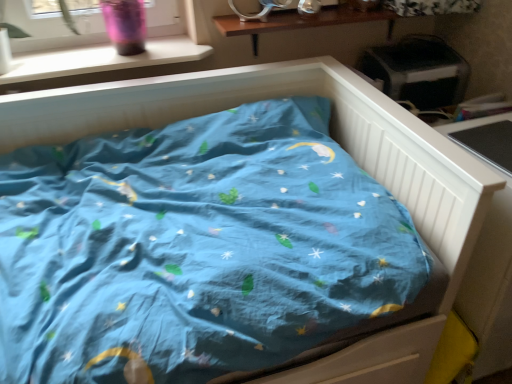
Image resolution: width=512 pixels, height=384 pixels. I want to click on white wooden table at right, so click(x=490, y=284).

Describe the element at coordinates (490, 284) in the screenshot. The width and height of the screenshot is (512, 384). I see `white wooden table at right` at that location.

Measure the distance between point (479, 371) and camera.

They are 1.31 meters apart.

What do you see at coordinates (96, 61) in the screenshot?
I see `white plastic window sill at upper left` at bounding box center [96, 61].

Identify the location of white plastic window sill at upper left. (96, 61).

I want to click on white wooden table at right, so click(x=490, y=284).

Between white wooden table at right and white plastic window sill at upper left, which one appears on the left side from the viewer's perspective?

white plastic window sill at upper left is more to the left.

Is white wooden table at right positioned in front of white plastic window sill at upper left?

That is True.

Which is behind, point (499, 358) or point (145, 53)?

The point (145, 53) is behind.

Consider the image. From the image's perspective, is white wooden table at right above white plastic window sill at upper left?

No.

From a real-world perspective, is white wooden table at right physically below white plastic window sill at upper left?

Yes, from a real-world perspective, white wooden table at right is below white plastic window sill at upper left.

Considering the sizes of objects white wooden table at right and white plastic window sill at upper left in the image provided, who is thinner, white wooden table at right or white plastic window sill at upper left?

white plastic window sill at upper left is thinner.

Does white wooden table at right have a greater height compared to white plastic window sill at upper left?

Correct, white wooden table at right is much taller as white plastic window sill at upper left.

Does white wooden table at right have a larger size compared to white plastic window sill at upper left?

Yes, white wooden table at right is bigger than white plastic window sill at upper left.

Is white plastic window sill at upper left a part of white wooden table at right?

No, white plastic window sill at upper left is not surrounded by white wooden table at right.

Are white wooden table at right and white plastic window sill at upper left located far from each other?

white wooden table at right is far away from white plastic window sill at upper left.

Is white wooden table at right facing away from white plastic window sill at upper left?

No, white plastic window sill at upper left is not at the back of white wooden table at right.

What's the angular difference between white wooden table at right and white plastic window sill at upper left's facing directions?

There is a 1.19-degree angle between the facing directions of white wooden table at right and white plastic window sill at upper left.

I want to click on window sill behind the white wooden table at right, so click(x=96, y=61).

Does white plastic window sill at upper left appear on the right side of white wooden table at right?

No.

Between white plastic window sill at upper left and white wooden table at right, which one is positioned in front?

white wooden table at right is closer to the camera.

Considering the positions of point (165, 60) and point (507, 244), is point (165, 60) closer or farther from the camera than point (507, 244)?

Point (165, 60) is farther from the camera than point (507, 244).

From the image's perspective, is white plastic window sill at upper left positioned above or below white wooden table at right?

Based on their image positions, white plastic window sill at upper left is located above white wooden table at right.

From a real-world perspective, is white plastic window sill at upper left on top of white wooden table at right?

Yes, from a real-world perspective, white plastic window sill at upper left is on top of white wooden table at right.

Considering the sizes of objects white plastic window sill at upper left and white wooden table at right in the image provided, who is thinner, white plastic window sill at upper left or white wooden table at right?

white plastic window sill at upper left is thinner.

Based on the photo, between white plastic window sill at upper left and white wooden table at right, which one has more height?

Standing taller between the two is white wooden table at right.

Does white plastic window sill at upper left have a larger size compared to white wooden table at right?

Actually, white plastic window sill at upper left might be smaller than white wooden table at right.

Is white plastic window sill at upper left completely or partially outside of white wooden table at right?

Absolutely, white plastic window sill at upper left is external to white wooden table at right.

Are white plastic window sill at upper left and white wooden table at right located far from each other?

Yes.

Is white plastic window sill at upper left looking in the opposite direction of white wooden table at right?

white plastic window sill at upper left does not have its back to white wooden table at right.

What's the angular difference between white plastic window sill at upper left and white wooden table at right's facing directions?

There is a 1.19-degree angle between the facing directions of white plastic window sill at upper left and white wooden table at right.

How much distance is there between white plastic window sill at upper left and white wooden table at right?

A distance of 4.05 feet exists between white plastic window sill at upper left and white wooden table at right.

Locate an element on the screen. window sill that appears above the white wooden table at right (from a real-world perspective) is located at coordinates (96, 61).

The image size is (512, 384). I want to click on window sill behind the white wooden table at right, so click(96, 61).

Locate an element on the screen. The width and height of the screenshot is (512, 384). window sill on the left side of white wooden table at right is located at coordinates (96, 61).